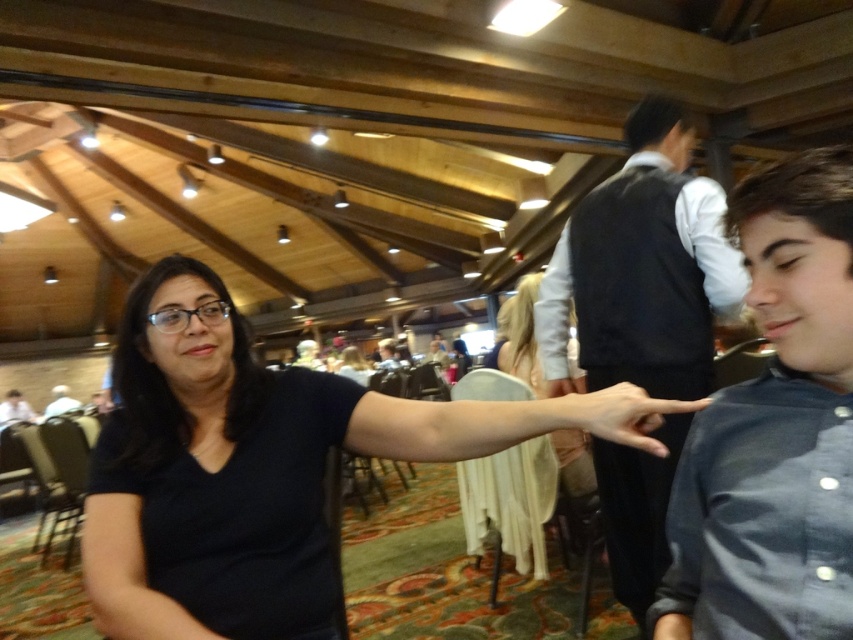
Question: Which of the following is the farthest from the observer?

Choices:
 (A) blue denim shirt at right
 (B) dark blue vest at center
 (C) white fabric at upper left

Answer: (C)

Question: Is blue denim shirt at right below dark blue vest at center?

Choices:
 (A) yes
 (B) no

Answer: (A)

Question: Does dark blue vest at center lie in front of white fabric at upper left?

Choices:
 (A) yes
 (B) no

Answer: (A)

Question: Which of these objects is positioned farthest from the white fabric at upper left?

Choices:
 (A) dark blue vest at center
 (B) black matte shirt at center
 (C) blue denim shirt at right
 (D) matte skin hand at center

Answer: (D)

Question: Which point is farther to the camera?

Choices:
 (A) dark blue vest at center
 (B) matte skin hand at center
 (C) white fabric at upper left
 (D) blue denim shirt at right

Answer: (C)

Question: Can you confirm if black matte shirt at center is bigger than dark blue vest at center?

Choices:
 (A) no
 (B) yes

Answer: (A)